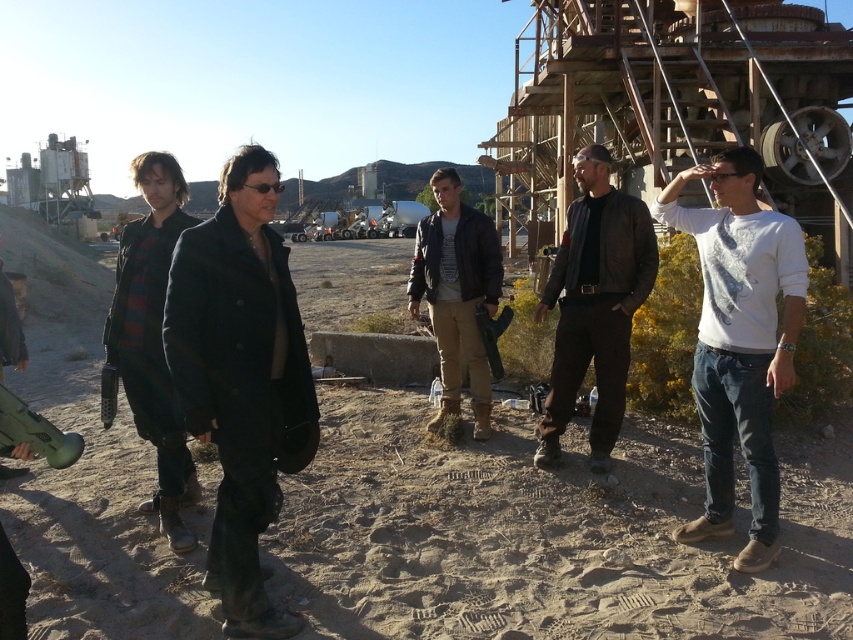
You are standing at the point labeled point (329,524) and want to walk towards the point labeled point (604,161). Which direction should you face to move directly towards it?

You should face towards the upper left direction because point (604,161) is located to the upper left of point (329,524).

You are a photographer trying to capture a group photo of the white cotton shirt at right and the brown leather jacket at center. Since you want both subjects to appear the same size in the photo, which subject should you move closer to the camera?

The white cotton shirt at right has a smaller size compared to brown leather jacket at center. To make them appear the same size in the photo, you should move the white cotton shirt at right closer to the camera because smaller objects need to be nearer to the lens to match the size of a larger object in the frame.